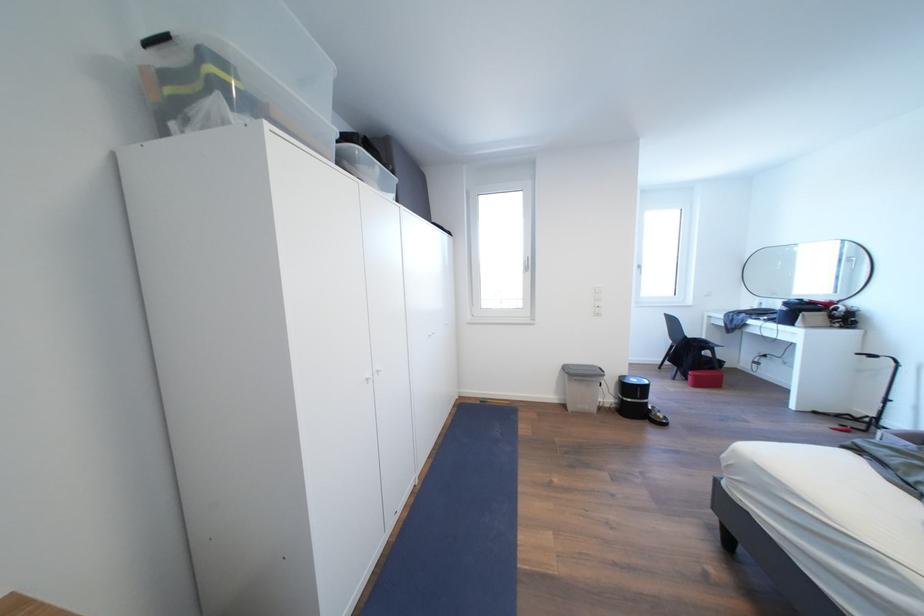
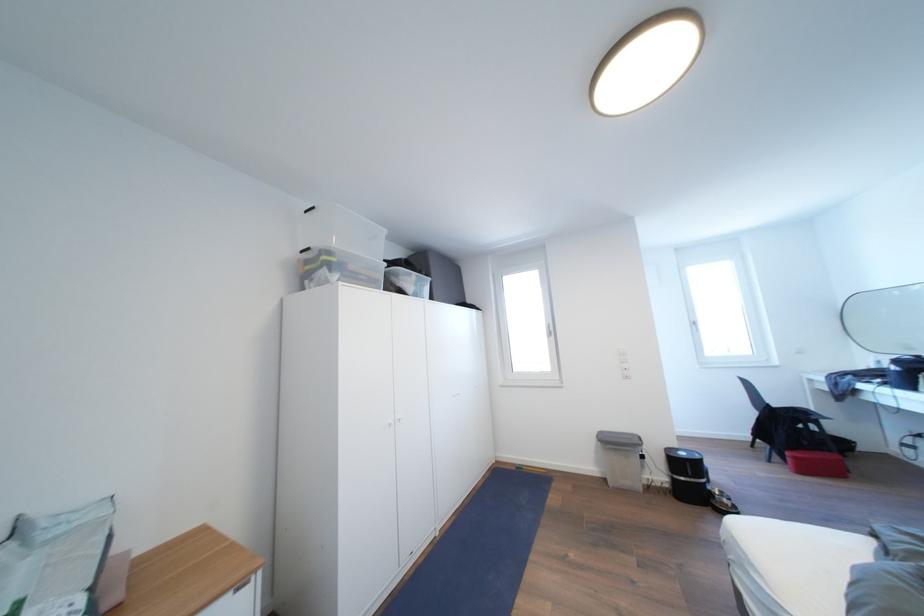
The point at (602, 371) is marked in the first image. Where is the corresponding point in the second image?

(639, 440)